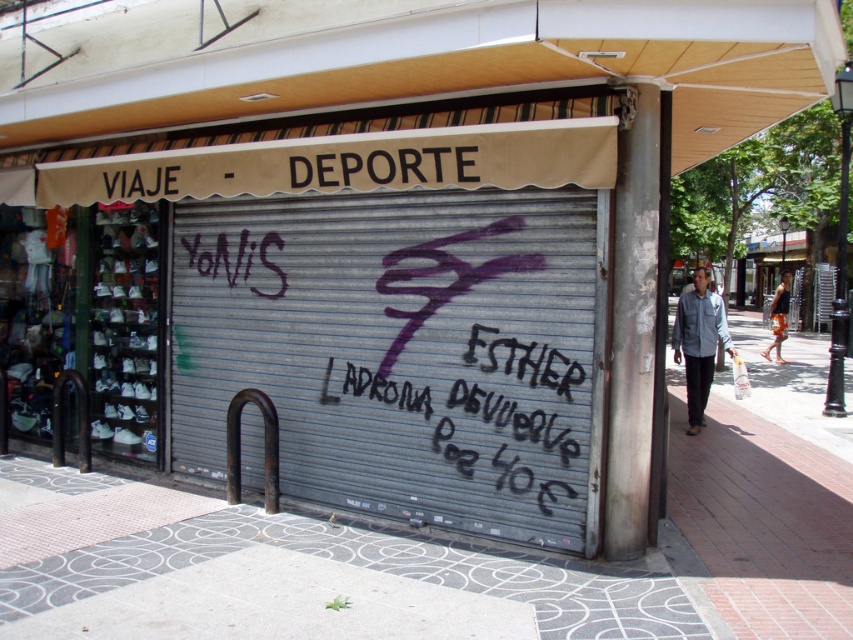
Does metallic gray garage door at center have a larger size compared to gray concrete sidewalk at lower center?

Indeed, metallic gray garage door at center has a larger size compared to gray concrete sidewalk at lower center.

Between point (339, 308) and point (321, 563), which one is positioned behind?

Positioned behind is point (339, 308).

This screenshot has height=640, width=853. I want to click on metallic gray garage door at center, so click(x=398, y=349).

Between metallic gray garage door at center and black chalk writing at center, which one is positioned higher?

metallic gray garage door at center

Locate an element on the screen. This screenshot has height=640, width=853. metallic gray garage door at center is located at coordinates (398, 349).

Which is more to the left, gray concrete sidewalk at lower center or black chalk writing at center?

gray concrete sidewalk at lower center

Can you confirm if gray concrete sidewalk at lower center is wider than black chalk writing at center?

Yes.

Which is in front, point (302, 602) or point (424, 413)?

Positioned in front is point (302, 602).

Locate an element on the screen. The height and width of the screenshot is (640, 853). gray concrete sidewalk at lower center is located at coordinates (287, 573).